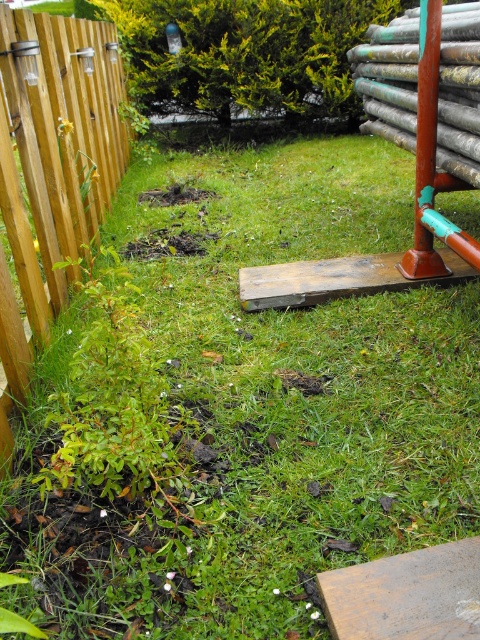
You are standing in the garden and want to walk from the wooden fence at left to the rusty metal pole at right. Which direction should you move to get closer to the pole?

To get closer to the rusty metal pole at right, you should move towards the right from the wooden fence at left since the pole is positioned to the right side of the fence.

You are standing at the point with coordinates point (78, 163) and want to walk towards the wooden fence. There is an obstacle at point (435, 116). Will you be able to see the wooden fence from your current position?

Since point (78, 163) is behind point (435, 116), the obstacle at point (435, 116) will block your view of the wooden fence.